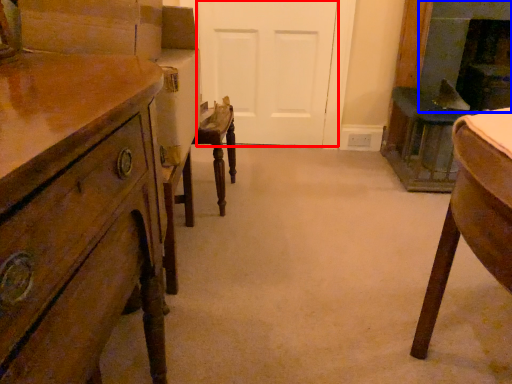
Question: Which of the following is the closest to the observer, door (highlighted by a red box) or fireplace (highlighted by a blue box)?

Choices:
 (A) door
 (B) fireplace

Answer: (B)